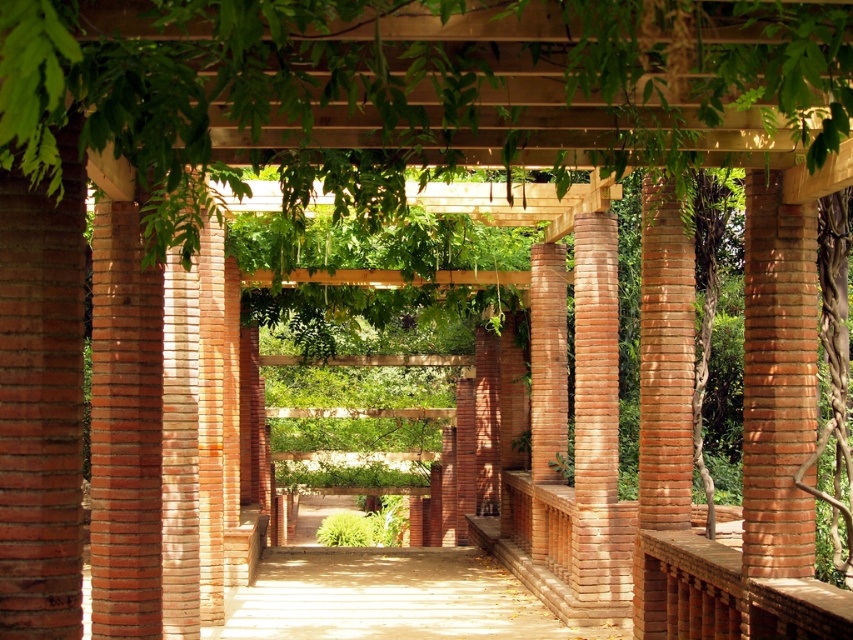
Does point (125, 300) come farther from viewer compared to point (743, 372)?

That is False.

Measure the distance between sandy brown brick column at left and red brick column at right.

They are 3.94 meters apart.

Is point (106, 259) closer to viewer compared to point (804, 520)?

No, (106, 259) is behind (804, 520).

What are the coordinates of `sandy brown brick column at left` in the screenshot? It's located at (125, 428).